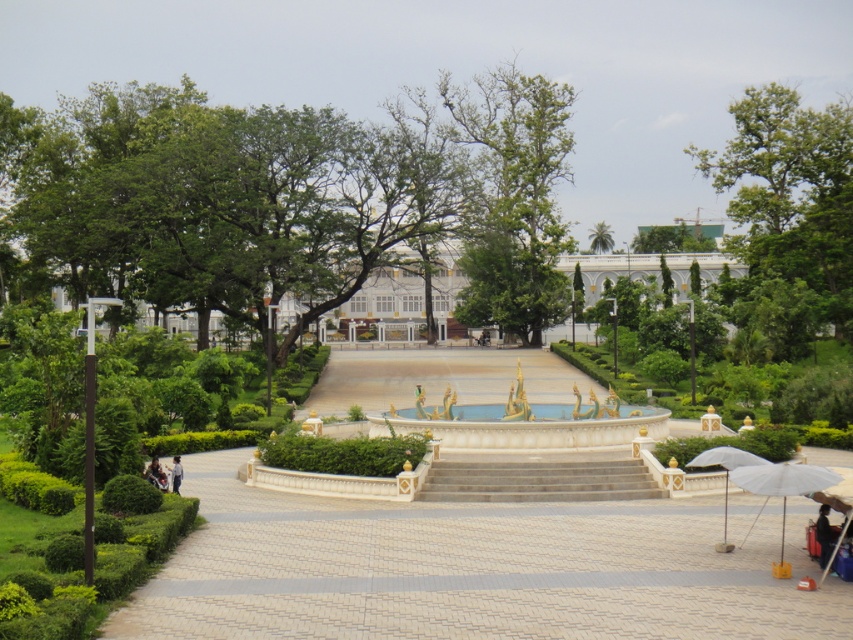
You are standing at the entrance of the park and see the white fabric umbrella at lower right and the green leafy tree at upper center. Which object is positioned more to the left side of the park?

The white fabric umbrella at lower right is positioned to the left of the green leafy tree at upper center, so it is more to the left side of the park.

You are planning to take a photo of the green leafy tree at upper center and the dark blue jeans at lower left. Which object should you focus on first if you want to capture both in a single frame without moving the camera?

The green leafy tree at upper center is bigger than the dark blue jeans at lower left, so you should focus on the green leafy tree at upper center first to ensure it fills the frame appropriately before adjusting for the smaller dark blue jeans at lower left.